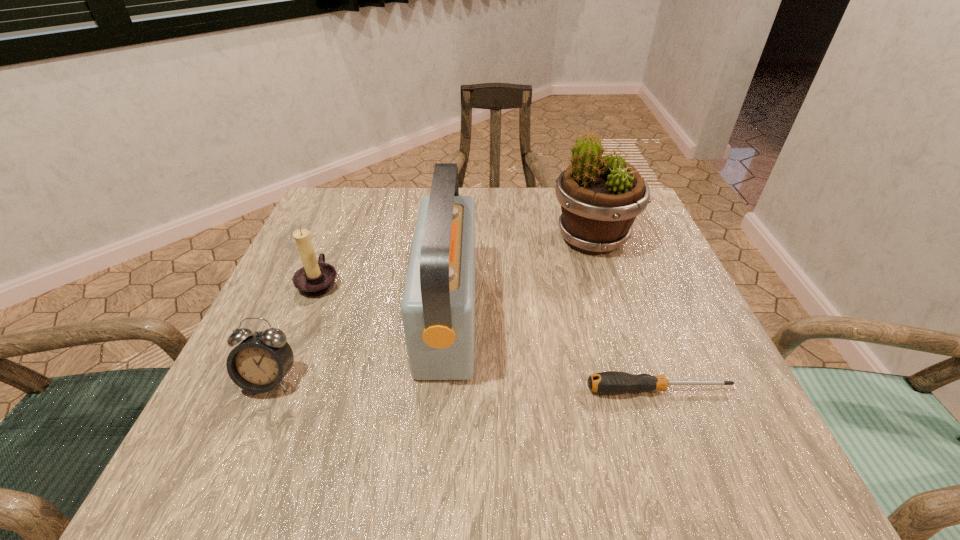
Identify the location of flowerpot. The height and width of the screenshot is (540, 960). click(x=600, y=197).

Where is `radio receiver`? The image size is (960, 540). radio receiver is located at coordinates (438, 305).

You are a GUI agent. You are given a task and a screenshot of the screen. Output one action in this format:
    pyautogui.click(x=<x>, y=<y>)
    Task: Click on the candle holder
    
    Given the screenshot: What is the action you would take?
    pyautogui.click(x=315, y=278)

Locate an element on the screen. alarm clock is located at coordinates (258, 364).

This screenshot has height=540, width=960. In order to click on screwdriver in this screenshot , I will do `click(610, 382)`.

Where is `free space located on the left of the flowerpot`? This screenshot has width=960, height=540. free space located on the left of the flowerpot is located at coordinates (450, 238).

Identify the location of blank space located on the front-facing side of the radio receiver. The image size is (960, 540). (681, 315).

Where is `free space located 0.210m on the wick of the candle holder`? Image resolution: width=960 pixels, height=540 pixels. free space located 0.210m on the wick of the candle holder is located at coordinates (442, 282).

You are a GUI agent. You are given a task and a screenshot of the screen. Output one action in this format:
    pyautogui.click(x=<x>, y=<y>)
    Task: Click on the vacant space positioned 0.070m on the face of the alarm clock
    The image size is (960, 540).
    Given the screenshot: What is the action you would take?
    pos(244,441)

I want to click on vacant area located 0.290m on the back of the screwdriver, so click(x=614, y=267).